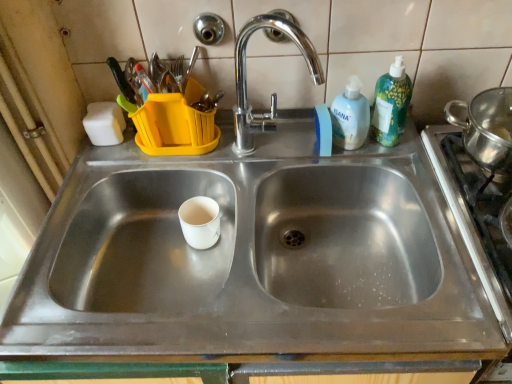
Locate an element on the screen. Image resolution: width=512 pixels, height=384 pixels. empty space that is to the right of white plastic bottle at upper right, the 1th cleaning product when ordered from left to right is located at coordinates pos(415,147).